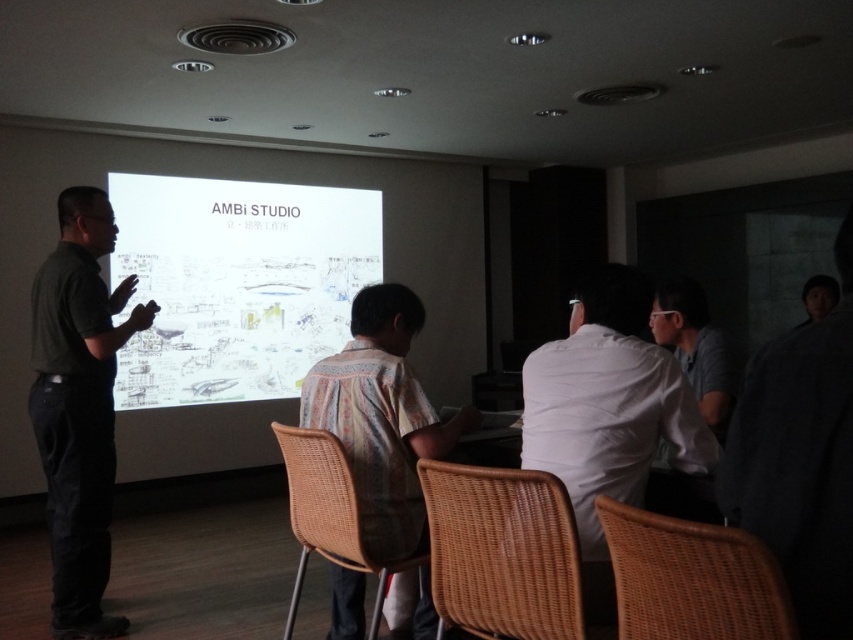
Who is more forward, (450,595) or (635,561)?

Positioned in front is point (635,561).

Can you confirm if woven wood chair at lower center is bigger than woven brown chair at lower right?

Yes, woven wood chair at lower center is bigger than woven brown chair at lower right.

Where is `woven wood chair at lower center`? The width and height of the screenshot is (853, 640). woven wood chair at lower center is located at coordinates (503, 554).

Is dark green shirt at left wider than woven brown chair at lower right?

Correct, the width of dark green shirt at left exceeds that of woven brown chair at lower right.

In the scene shown: Is dark green shirt at left taller than woven brown chair at lower right?

Indeed, dark green shirt at left has a greater height compared to woven brown chair at lower right.

Identify the location of dark green shirt at left. (79, 406).

Between white paper at center and woven brown chair at lower right, which one is positioned higher?

white paper at center

Image resolution: width=853 pixels, height=640 pixels. I want to click on white paper at center, so click(236, 284).

Measure the distance between point [242,340] and camera.

They are 17.85 feet apart.

Identify the location of white paper at center. This screenshot has width=853, height=640. (236, 284).